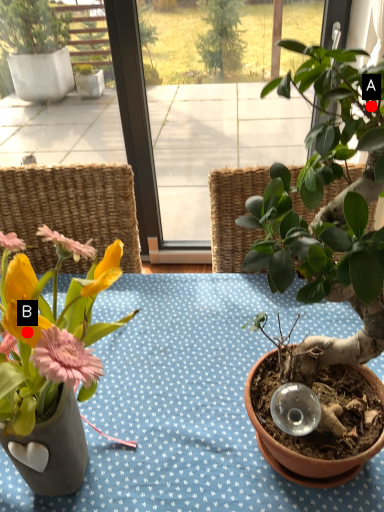
Question: Two points are circled on the image, labeled by A and B beside each circle. Which point is farther to the camera?

Choices:
 (A) A is further
 (B) B is further

Answer: (A)